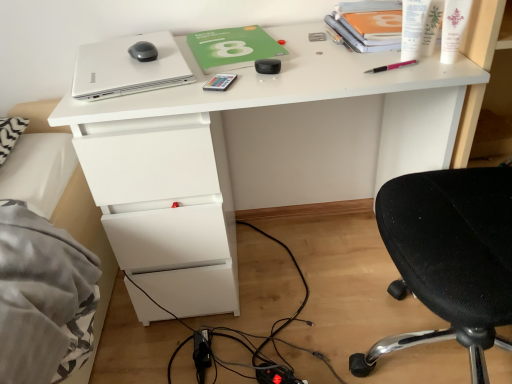
Where is `vacant space behind pink plastic pen at upper right, the second stationery in the left-to-right sequence`? vacant space behind pink plastic pen at upper right, the second stationery in the left-to-right sequence is located at coordinates (355, 51).